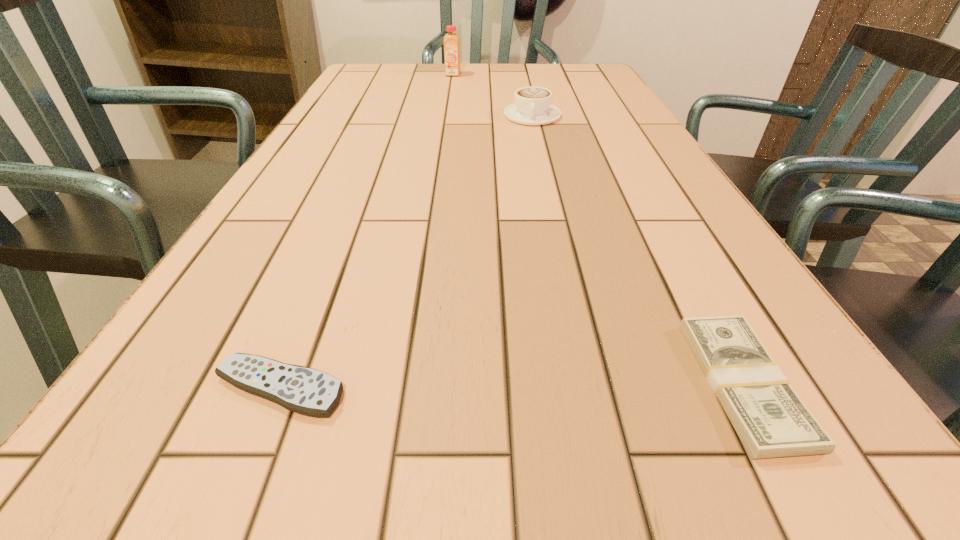
I want to click on the tallest object, so (451, 41).

Locate an element on the screen. orange juice is located at coordinates (451, 41).

You are a GUI agent. You are given a task and a screenshot of the screen. Output one action in this format:
    pyautogui.click(x=<x>, y=<y>)
    Task: Click on the cappuccino
    
    Given the screenshot: What is the action you would take?
    pyautogui.click(x=532, y=106)

The width and height of the screenshot is (960, 540). Find the location of `the third shortest object`. the third shortest object is located at coordinates 532,106.

Where is `the rightmost object`? the rightmost object is located at coordinates (771, 420).

Image resolution: width=960 pixels, height=540 pixels. In order to click on remote control in this screenshot , I will do `click(308, 391)`.

Where is `free region located on the front and back of the tallest object`? free region located on the front and back of the tallest object is located at coordinates (452, 83).

Where is `vacant area located 0.150m with the handle on the right side of the cappuccino`? The image size is (960, 540). vacant area located 0.150m with the handle on the right side of the cappuccino is located at coordinates (541, 155).

Identify the location of vacant region located 0.130m on the back of the dollar. (678, 262).

Find the location of `vacant area situated 0.390m on the right of the remote control`. vacant area situated 0.390m on the right of the remote control is located at coordinates (685, 388).